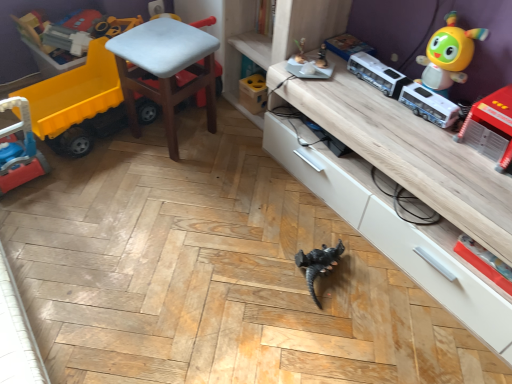
Question: Can you confirm if shiny yellow toy at upper right, the second toy viewed from the right, is positioned to the left of rubber yellow truck at left, which appears as the fifth toy when viewed from the right?

Choices:
 (A) no
 (B) yes

Answer: (A)

Question: From a real-world perspective, is shiny yellow toy at upper right, the second toy viewed from the right, below rubber yellow truck at left, which appears as the fifth toy when viewed from the right?

Choices:
 (A) no
 (B) yes

Answer: (A)

Question: Is the depth of shiny yellow toy at upper right, the second toy viewed from the right, less than that of rubber yellow truck at left, which appears as the fifth toy when viewed from the right?

Choices:
 (A) yes
 (B) no

Answer: (A)

Question: Is shiny yellow toy at upper right, which appears as the fourth toy when viewed from the left, at the right side of rubber yellow truck at left, the first toy viewed from the left?

Choices:
 (A) yes
 (B) no

Answer: (A)

Question: Is shiny yellow toy at upper right, the second toy viewed from the right, placed right next to rubber yellow truck at left, the first toy viewed from the left?

Choices:
 (A) yes
 (B) no

Answer: (B)

Question: From a real-world perspective, is rubber yellow truck at left, the first toy viewed from the left, above or below shiny yellow toy at upper right, which appears as the fourth toy when viewed from the left?

Choices:
 (A) above
 (B) below

Answer: (B)

Question: Considering the positions of point (32, 92) and point (478, 36), is point (32, 92) closer or farther from the camera than point (478, 36)?

Choices:
 (A) closer
 (B) farther

Answer: (B)

Question: From the image's perspective, is rubber yellow truck at left, which appears as the fifth toy when viewed from the right, located above or below shiny yellow toy at upper right, which appears as the fourth toy when viewed from the left?

Choices:
 (A) below
 (B) above

Answer: (A)

Question: In terms of width, does rubber yellow truck at left, the first toy viewed from the left, look wider or thinner when compared to shiny yellow toy at upper right, the second toy viewed from the right?

Choices:
 (A) wide
 (B) thin

Answer: (A)

Question: Looking at the image, does white plastic chair at center seem bigger or smaller compared to wooden cabinet at lower center?

Choices:
 (A) big
 (B) small

Answer: (B)

Question: Considering the positions of white plastic chair at center and wooden cabinet at lower center in the image, is white plastic chair at center taller or shorter than wooden cabinet at lower center?

Choices:
 (A) short
 (B) tall

Answer: (B)

Question: Relative to wooden cabinet at lower center, is white plastic chair at center in front or behind?

Choices:
 (A) behind
 (B) front

Answer: (A)

Question: Do you think white plastic chair at center is within wooden cabinet at lower center, or outside of it?

Choices:
 (A) inside
 (B) outside

Answer: (B)

Question: In terms of width, does white plastic chair at center look wider or thinner when compared to shiny yellow toy at upper right, the second toy viewed from the right?

Choices:
 (A) thin
 (B) wide

Answer: (B)

Question: Is point (162, 74) closer or farther from the camera than point (444, 54)?

Choices:
 (A) closer
 (B) farther

Answer: (B)